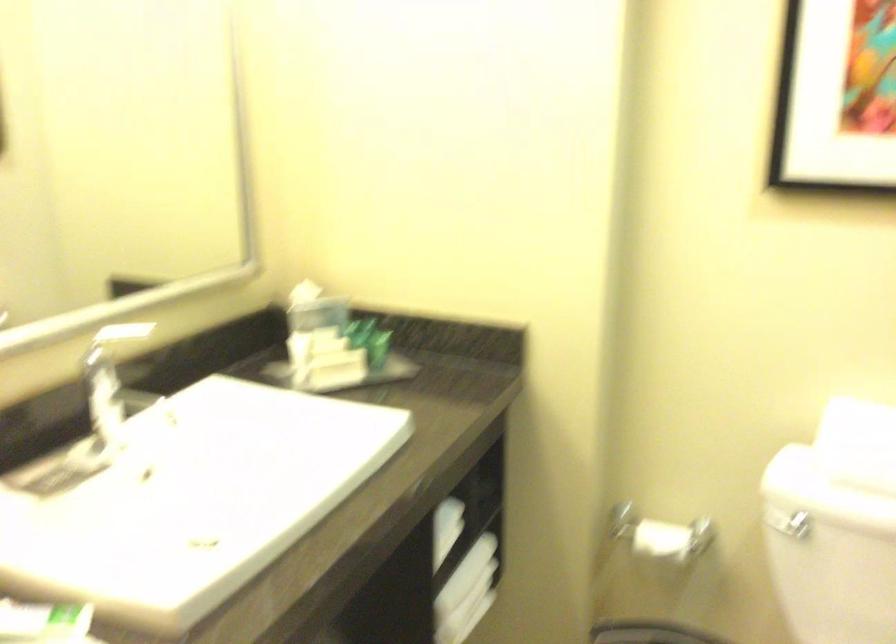
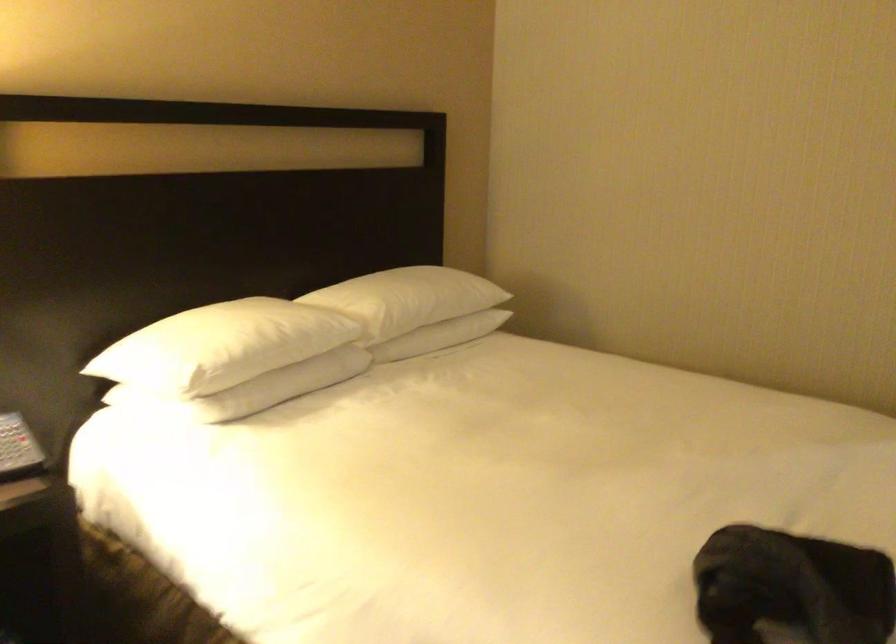
Question: I am providing you with two images of the same scene from different viewpoints. After the viewpoint changes to image2, which objects are now occluded?

Choices:
 (A) purple container
 (B) small green bottle
 (C) telephone handset
 (D) white pillow

Answer: (B)